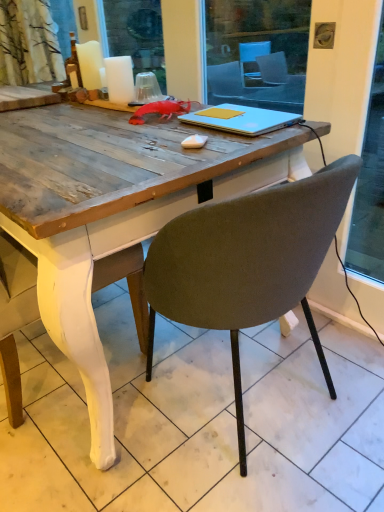
Question: Is yellow matte notebook at center, the first notebook when ordered from top to bottom, situated inside matte gray chair at center or outside?

Choices:
 (A) inside
 (B) outside

Answer: (B)

Question: In the image, is yellow matte notebook at center, which is the 2th notebook from bottom to top, on the left side or the right side of matte gray chair at center?

Choices:
 (A) right
 (B) left

Answer: (B)

Question: Estimate the real-world distances between objects in this image. Which object is closer to the matte gray chair at center?

Choices:
 (A) silver metallic laptop at center, the 1th notebook in the bottom-to-top sequence
 (B) white matte candle at upper left, which ranks as the 1th candle in back-to-front order
 (C) white matte candle at upper left, which is the 1th candle from front to back
 (D) yellow matte notebook at center, the first notebook when ordered from top to bottom

Answer: (A)

Question: Which object is positioned farthest from the white matte candle at upper left, which is the 1th candle from front to back?

Choices:
 (A) yellow matte notebook at center, the first notebook when ordered from top to bottom
 (B) silver metallic laptop at center, the 1th notebook in the bottom-to-top sequence
 (C) white matte candle at upper left, which ranks as the 1th candle in back-to-front order
 (D) matte gray chair at center

Answer: (D)